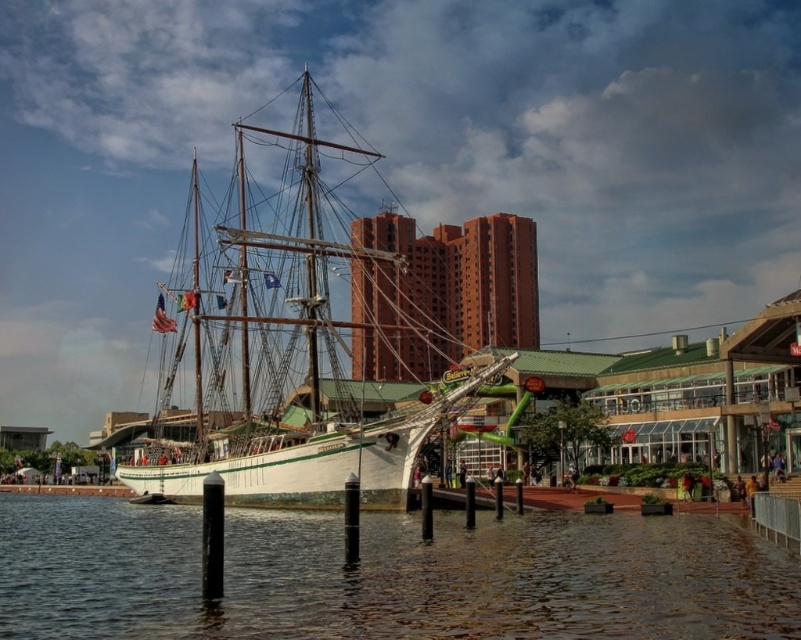
Is clear water at lower left thinner than white matte ship at center?

Correct, clear water at lower left's width is less than white matte ship at center's.

Consider the image. Between clear water at lower left and white matte ship at center, which one is positioned lower?

clear water at lower left is below.

Describe the element at coordinates (385, 576) in the screenshot. I see `clear water at lower left` at that location.

The width and height of the screenshot is (801, 640). Identify the location of clear water at lower left. (385, 576).